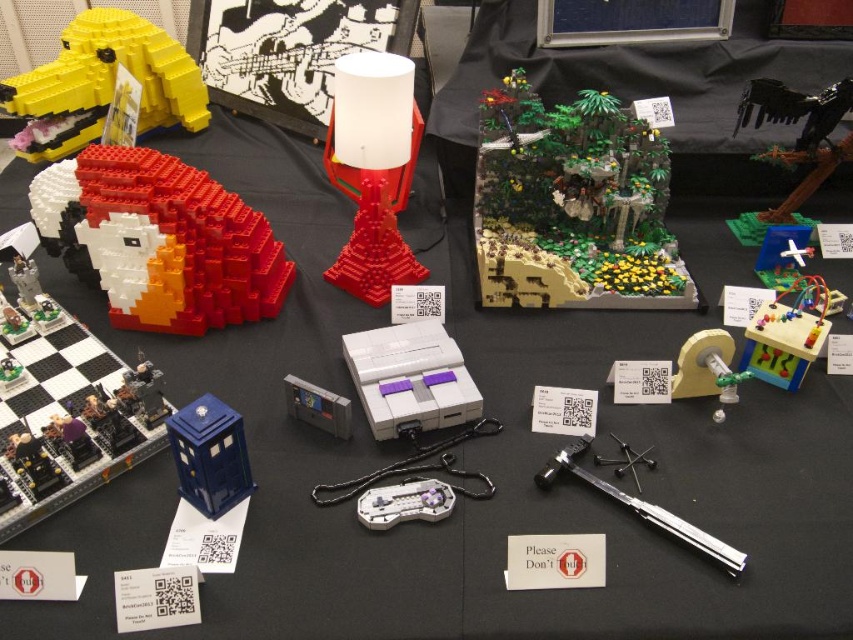
Question: Is brick yellow dog at upper left bigger than wooden puzzle at center-right?

Choices:
 (A) no
 (B) yes

Answer: (B)

Question: Which of the following is the closest to the observer?

Choices:
 (A) (192, 502)
 (B) (631, 502)

Answer: (A)

Question: Can you confirm if brick yellow dog at upper left is positioned to the left of matte red lamp at center?

Choices:
 (A) yes
 (B) no

Answer: (A)

Question: Which point is closer to the camera taking this photo?

Choices:
 (A) (350, 355)
 (B) (216, 440)
 (C) (561, 216)
 (D) (45, 506)

Answer: (B)

Question: Which is farther from the green matte forest diorama at center?

Choices:
 (A) clear plastic game controller at center
 (B) wooden puzzle at center-right

Answer: (A)

Question: Is brick yellow dog at upper left wider than clear plastic game controller at center?

Choices:
 (A) yes
 (B) no

Answer: (A)